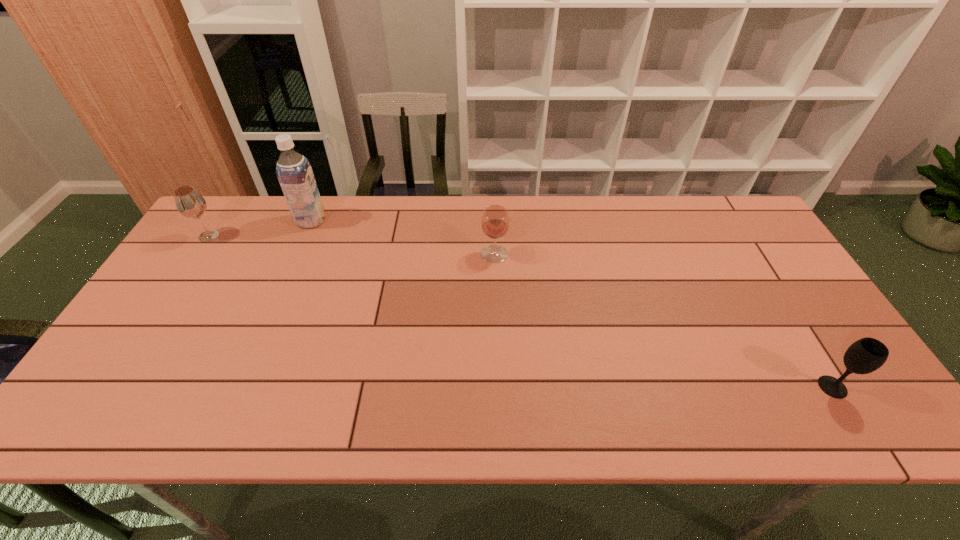
This screenshot has height=540, width=960. I want to click on vacant space at the near edge, so click(584, 408).

Locate an element on the screen. The image size is (960, 540). free space at the left edge of the desktop is located at coordinates (194, 327).

Find the location of `vacant space at the right edge of the desktop`. vacant space at the right edge of the desktop is located at coordinates (824, 324).

At what (x,y) coordinates should I click in order to perform the action: click on free location at the far left corner of the desktop. Please return your answer as a coordinate pair (x, y). Looking at the image, I should click on (264, 208).

In the image, there is a desktop. Identify the location of free space at the near right corner. (879, 432).

Find the location of a particular element. This screenshot has width=960, height=540. unoccupied area between the nearest object and the farthest wineglass is located at coordinates (520, 312).

Locate an element on the screen. Image resolution: width=960 pixels, height=540 pixels. free space between the third object from left to right and the soya milk is located at coordinates (403, 238).

This screenshot has width=960, height=540. What are the coordinates of `vacant space that is in between the farthest wineglass and the second wineglass from right to left` in the screenshot? It's located at (351, 245).

What are the coordinates of `free space between the second wineglass from left to right and the farthest wineglass` in the screenshot? It's located at (351, 245).

Find the location of a particular element. free spot between the farthest wineglass and the tallest object is located at coordinates (260, 228).